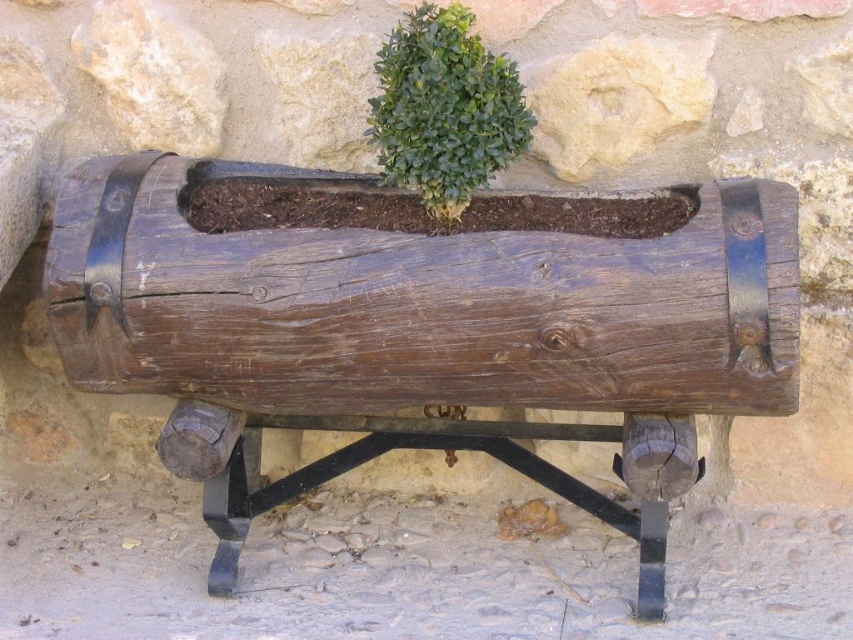
You are standing in front of the rustic wooden planter box and notice a green leafy bush behind it. Which object is closer to you, the rustic wood planter at center or the green leafy bush at center?

The rustic wood planter at center is closer to the viewer than the green leafy bush at center.

You are standing in front of the rustic wooden planter box. There is a point marked at coordinates (422, 323). Based on the scene description, where is this point located?

The point at (422, 323) is located on the rustic wood planter at center.